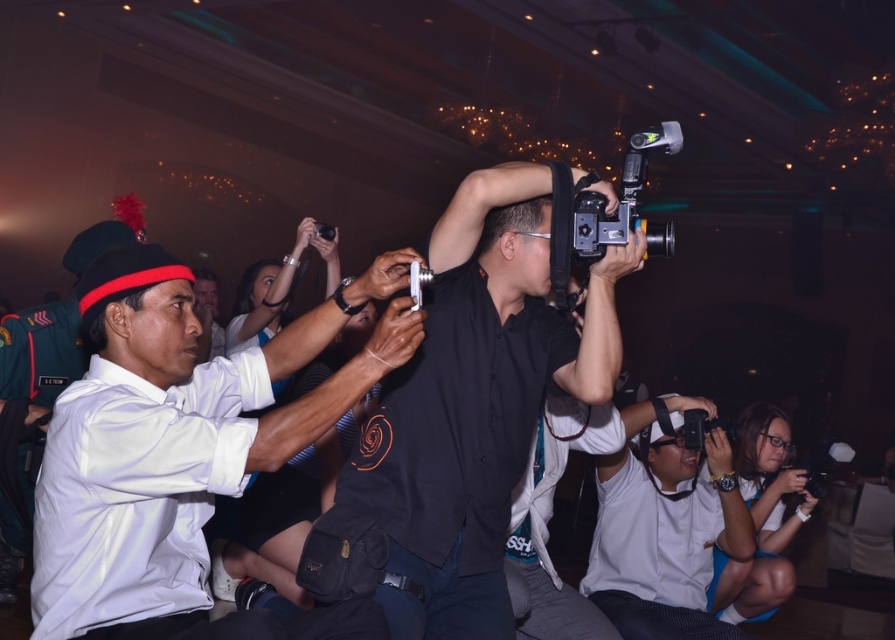
You are standing in the middle of the room and want to take a photo of both the point at coordinates point(604, 554) and point(661, 228). Which point should you focus on first to ensure both are in the frame?

You should focus on point(604, 554) first because it is closer to you than point(661, 228), so adjusting the camera to include both points will require framing starting from the closer point.

You are a photographer at the event and need to position your camera to capture the white matte shirt at center and the black plastic video camera at upper center. Which object should you focus on first if you want to prioritize the taller one?

The white matte shirt at center has a greater height compared to the black plastic video camera at upper center, so you should focus on the white matte shirt at center first since it is taller.

You are organizing a costume party and need to ensure that all outfits are correctly labeled. You have two items labeled as white matte uniform at center and white matte shirt at center. Based on their sizes, which one is more likely to be the uniform?

The white matte uniform at center is more likely to be the uniform because it has a smaller size compared to the white matte shirt at center, indicating it might be part of a coordinated ensemble designed for a specific role or profession.